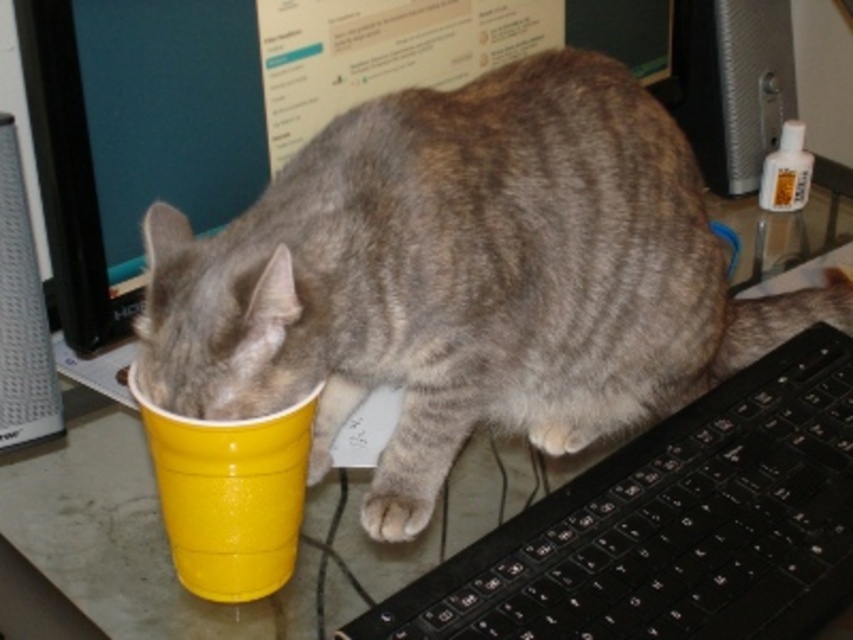
You are trying to place a 50 cm wide object on the desk. The point where you want to place it is at coordinate point (x=695, y=586). Given that the distance from this point to the camera is 76.48 centimeters, will the object fit without overlapping the cat or the yellow plastic cup?

The distance from the point to the camera is 76.48 cm, and the object is 50 cm wide. Since the object is narrower than the distance, it should fit without overlapping the cat or the cup, provided there is enough space along the depth. However, spatial arrangement details beyond width aren

You are organizing items on a desk and need to place a new mouse between the black plastic keyboard at lower right and the yellow plastic cup at lower left. Based on their positions, which item is closer to you so that you can position the mouse appropriately?

The black plastic keyboard at lower right is closer to you than the yellow plastic cup at lower left, so you should place the mouse between them near the keyboard since it is closer.

You are organizing the desk and need to place a new mouse next to the black plastic keyboard at lower right. According to the coordinates provided, where should you position the mouse relative to the keyboard?

The black plastic keyboard at lower right is located at point (672, 525). You should position the mouse near those coordinates to place it next to the keyboard.